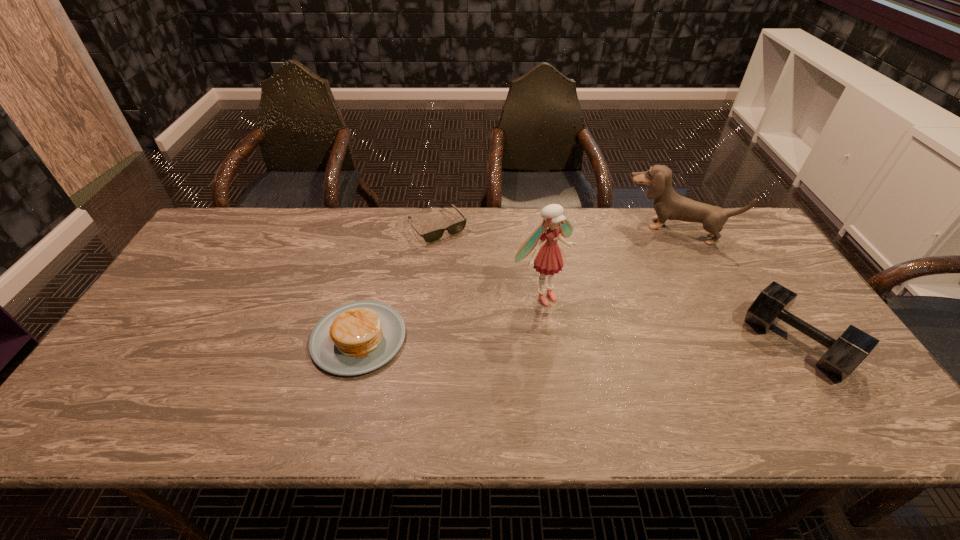
At what (x,y) coordinates should I click in order to perform the action: click on vacant space located 0.280m at the face of the puppy. Please return your answer as a coordinate pair (x, y). Looking at the image, I should click on click(x=636, y=302).

Where is `vacant area situated on the front-facing side of the sunglasses`? The image size is (960, 540). vacant area situated on the front-facing side of the sunglasses is located at coordinates (490, 286).

Locate an element on the screen. This screenshot has width=960, height=540. blank area located on the front-facing side of the sunglasses is located at coordinates (467, 260).

You are a GUI agent. You are given a task and a screenshot of the screen. Output one action in this format:
    pyautogui.click(x=<x>, y=<y>)
    Task: Click on the vacant space positioned 0.340m on the front-facing side of the sunglasses
    Image resolution: width=960 pixels, height=540 pixels.
    Given the screenshot: What is the action you would take?
    pyautogui.click(x=511, y=311)

Find the location of a particular element. The image size is (960, 540). vacant region located 0.140m on the front-facing side of the doll is located at coordinates (597, 342).

Locate an element on the screen. The width and height of the screenshot is (960, 540). vacant space situated on the front-facing side of the doll is located at coordinates (637, 378).

Locate an element on the screen. free region located 0.150m on the front-facing side of the doll is located at coordinates (600, 345).

Where is `puppy at the far edge`? This screenshot has height=540, width=960. puppy at the far edge is located at coordinates (668, 205).

Image resolution: width=960 pixels, height=540 pixels. I want to click on sunglasses present at the far edge, so click(x=434, y=235).

The image size is (960, 540). Identify the location of pancake that is at the near edge. (355, 338).